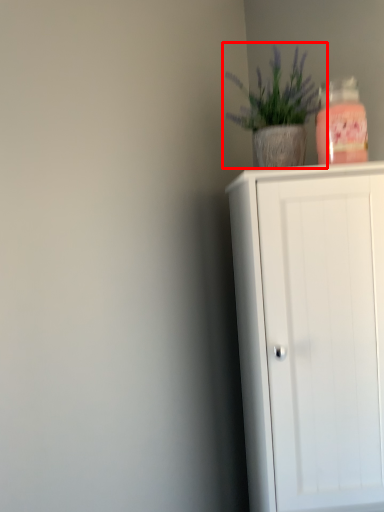
Question: Where is houseplant (annotated by the red box) located in relation to cupboard in the image?

Choices:
 (A) right
 (B) left

Answer: (B)